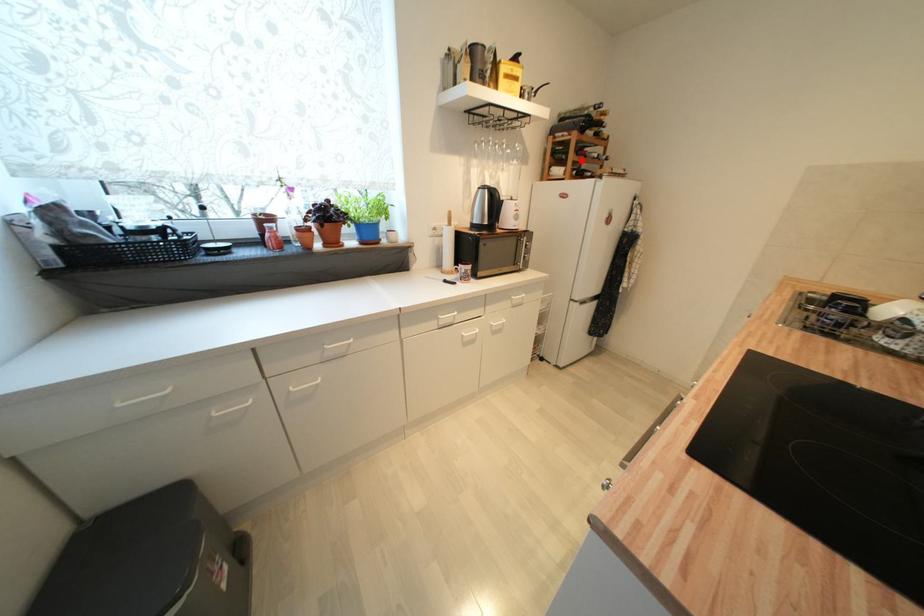
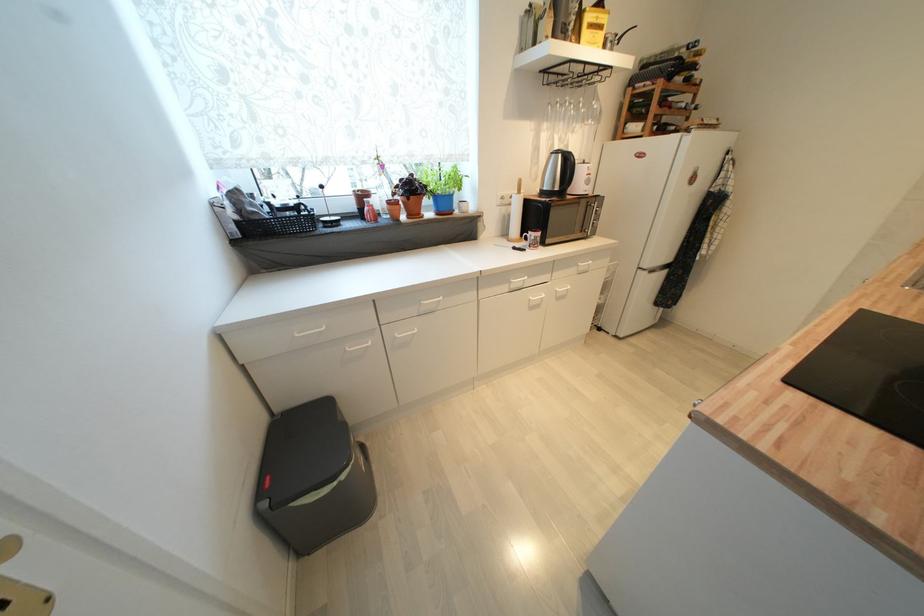
Locate, in the second image, the point that corresponds to the highlighted location in the first image.

(664, 114)